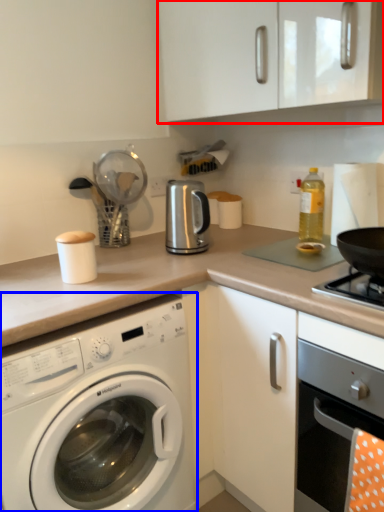
Question: Among these objects, which one is farthest to the camera, cabinetry (highlighted by a red box) or washing machine (highlighted by a blue box)?

Choices:
 (A) cabinetry
 (B) washing machine

Answer: (A)